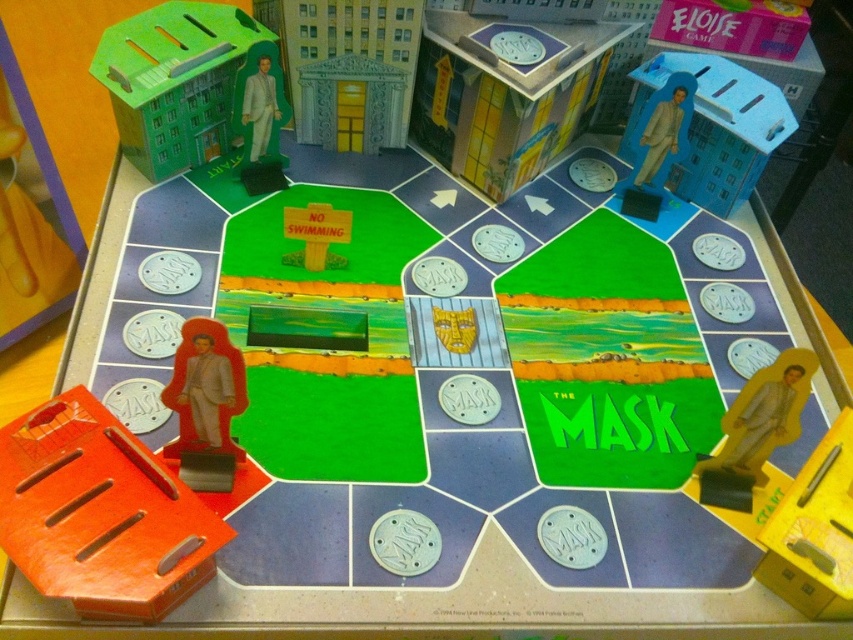
Which is more to the left, matte plastic building at upper center or matte plastic figure at upper right?

From the viewer's perspective, matte plastic building at upper center appears more on the left side.

Is point (602, 67) positioned in front of point (755, 182)?

That is False.

Where is `matte plastic building at upper center`? matte plastic building at upper center is located at coordinates (506, 92).

What do you see at coordinates (177, 81) in the screenshot?
I see `green cardboard building at upper left` at bounding box center [177, 81].

Does green cardboard building at upper left have a lesser width compared to matte plastic figure at upper right?

Incorrect, green cardboard building at upper left's width is not less than matte plastic figure at upper right's.

Between point (171, 65) and point (700, 112), which one is positioned in front?

Point (171, 65)

The height and width of the screenshot is (640, 853). Find the location of `green cardboard building at upper left`. green cardboard building at upper left is located at coordinates (177, 81).

Which of these two, orange plastic tray at lower left or matte plastic figure at upper right, stands taller?

matte plastic figure at upper right

Where is `orange plastic tray at lower left`? Image resolution: width=853 pixels, height=640 pixels. orange plastic tray at lower left is located at coordinates (100, 513).